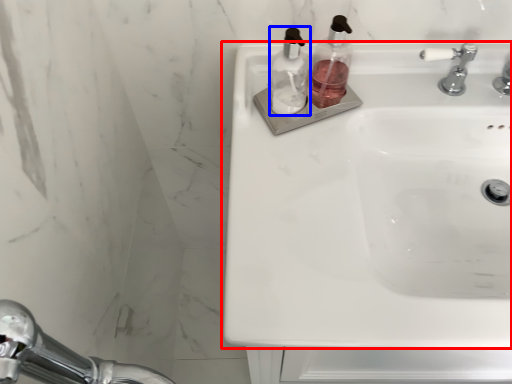
Question: Which object is further to the camera taking this photo, sink (highlighted by a red box) or soap dispenser (highlighted by a blue box)?

Choices:
 (A) sink
 (B) soap dispenser

Answer: (B)